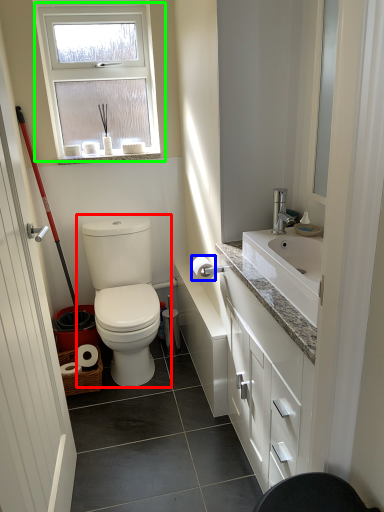
Question: Which is farther away from toilet (highlighted by a red box)? toilet paper (highlighted by a blue box) or window (highlighted by a green box)?

Choices:
 (A) toilet paper
 (B) window

Answer: (B)